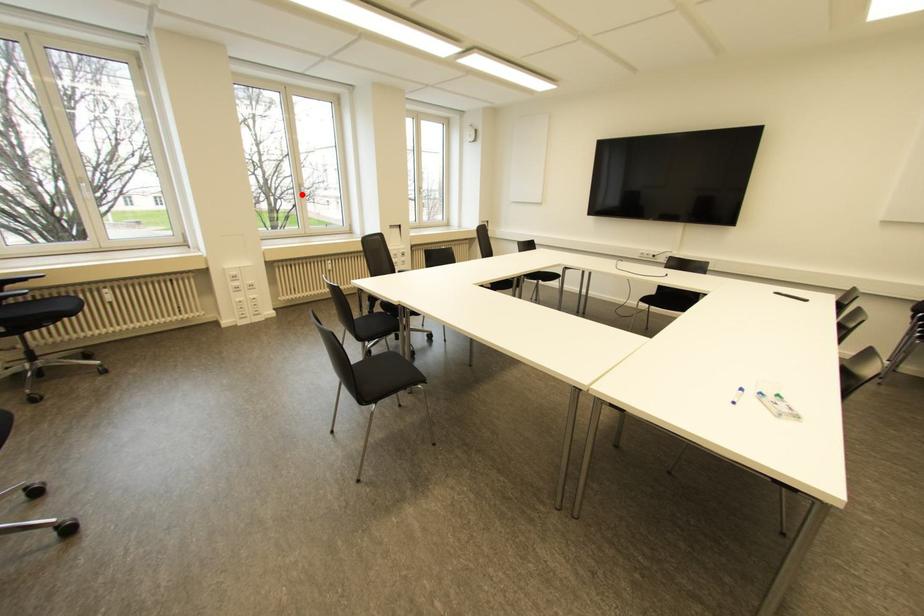
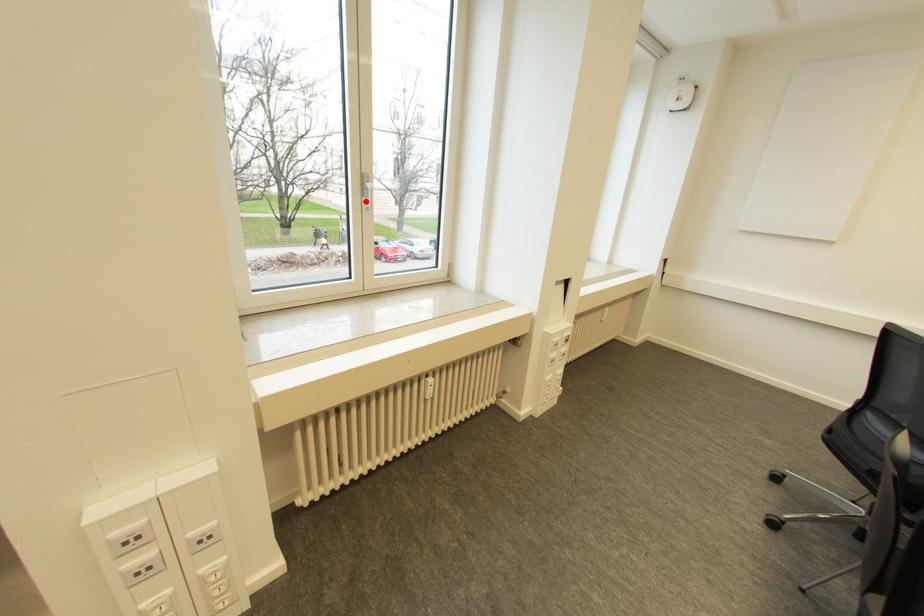
I am providing you with two images of the same scene from different viewpoints. A red point is marked on the first image and another point is marked on the second image. Does the point marked in image1 correspond to the same location as the one in image2?

Yes